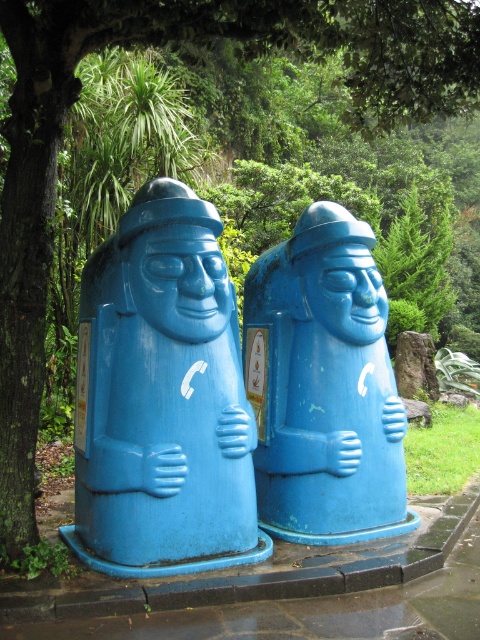
Question: Is blue matte phone booth at center in front of blue matte sculpture at center?

Choices:
 (A) no
 (B) yes

Answer: (B)

Question: Which object appears farthest from the camera in this image?

Choices:
 (A) blue matte sculpture at center
 (B) blue matte phone booth at center

Answer: (A)

Question: Which object appears closest to the camera in this image?

Choices:
 (A) blue matte phone booth at center
 (B) blue matte sculpture at center

Answer: (A)

Question: Is blue matte phone booth at center positioned at the back of blue matte sculpture at center?

Choices:
 (A) no
 (B) yes

Answer: (A)

Question: Observing the image, what is the correct spatial positioning of blue matte phone booth at center in reference to blue matte sculpture at center?

Choices:
 (A) right
 (B) left

Answer: (B)